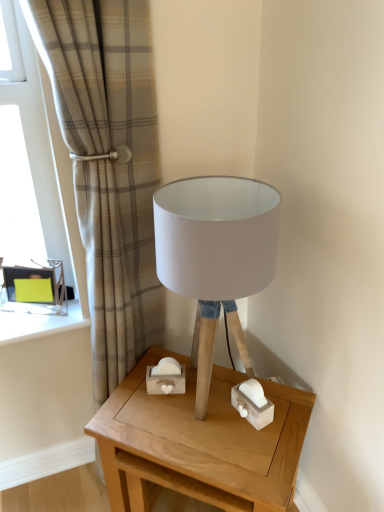
Question: Does wooden table at center touch white fabric lampshade at center?

Choices:
 (A) yes
 (B) no

Answer: (B)

Question: From the image's perspective, would you say wooden table at center is shown under white fabric lampshade at center?

Choices:
 (A) yes
 (B) no

Answer: (A)

Question: Can you confirm if wooden table at center is thinner than white fabric lampshade at center?

Choices:
 (A) yes
 (B) no

Answer: (B)

Question: Would you say white fabric lampshade at center is part of wooden table at center's contents?

Choices:
 (A) yes
 (B) no

Answer: (B)

Question: Does wooden table at center have a greater width compared to white fabric lampshade at center?

Choices:
 (A) no
 (B) yes

Answer: (B)

Question: Does wooden table at center have a greater height compared to white fabric lampshade at center?

Choices:
 (A) yes
 (B) no

Answer: (B)

Question: Considering the relative sizes of wooden table at center and green cardboard box at left in the image provided, is wooden table at center taller than green cardboard box at left?

Choices:
 (A) no
 (B) yes

Answer: (B)

Question: Is wooden table at center completely or partially outside of green cardboard box at left?

Choices:
 (A) yes
 (B) no

Answer: (A)

Question: Is wooden table at center at the right side of green cardboard box at left?

Choices:
 (A) yes
 (B) no

Answer: (A)

Question: Considering the relative sizes of wooden table at center and green cardboard box at left in the image provided, is wooden table at center wider than green cardboard box at left?

Choices:
 (A) no
 (B) yes

Answer: (B)

Question: Is the position of wooden table at center less distant than that of green cardboard box at left?

Choices:
 (A) yes
 (B) no

Answer: (A)

Question: From the image's perspective, would you say wooden table at center is shown under green cardboard box at left?

Choices:
 (A) no
 (B) yes

Answer: (B)

Question: Is green cardboard box at left with wooden table at center?

Choices:
 (A) yes
 (B) no

Answer: (B)